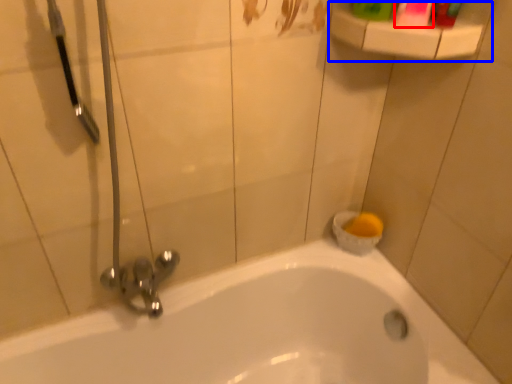
Question: Which object is closer to the camera taking this photo, mouthwash (highlighted by a red box) or balustrade (highlighted by a blue box)?

Choices:
 (A) mouthwash
 (B) balustrade

Answer: (A)